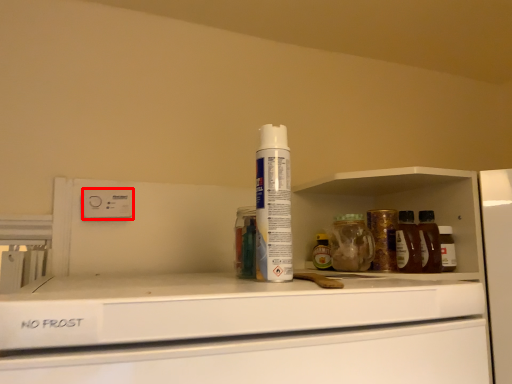
Question: Where is electric outlet (annotated by the red box) located in relation to shaving cream in the image?

Choices:
 (A) left
 (B) right

Answer: (A)